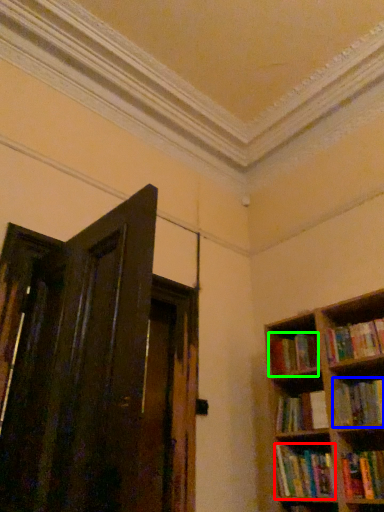
Question: Based on their relative distances, which object is farther from book (highlighted by a red box)? Choose from book (highlighted by a blue box) and book (highlighted by a green box).

Choices:
 (A) book
 (B) book

Answer: (B)